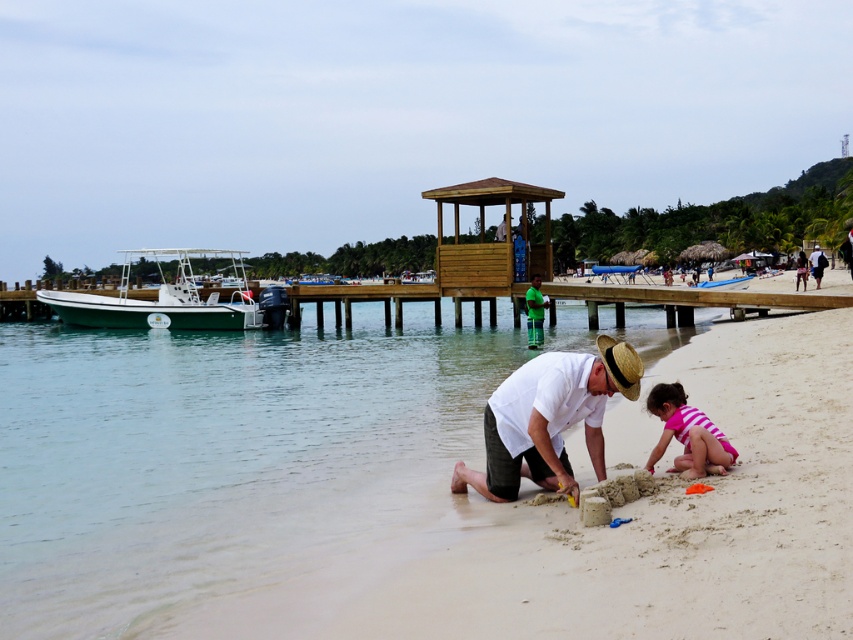
Is beige sandy beach at lower center to the right of pink striped swimsuit at lower right from the viewer's perspective?

Correct, you'll find beige sandy beach at lower center to the right of pink striped swimsuit at lower right.

Which of these two, beige sandy beach at lower center or pink striped swimsuit at lower right, stands shorter?

pink striped swimsuit at lower right

Which is in front, point (795, 509) or point (659, 445)?

Point (795, 509) is in front.

Identify the location of beige sandy beach at lower center. (x=622, y=529).

Is pink striped swimsuit at lower right further to the viewer compared to white cotton shirt at lower right?

No, pink striped swimsuit at lower right is closer to the viewer.

Measure the distance between pink striped swimsuit at lower right and white cotton shirt at lower right.

pink striped swimsuit at lower right is 33.95 meters from white cotton shirt at lower right.

Image resolution: width=853 pixels, height=640 pixels. Describe the element at coordinates (686, 433) in the screenshot. I see `pink striped swimsuit at lower right` at that location.

Locate an element on the screen. pink striped swimsuit at lower right is located at coordinates (686, 433).

Is beige sandy beach at lower center taller than white matte shirt at center?

Correct, beige sandy beach at lower center is much taller as white matte shirt at center.

Does point (219, 604) lie behind point (541, 433)?

No, it is not.

Where is `beige sandy beach at lower center`? beige sandy beach at lower center is located at coordinates (622, 529).